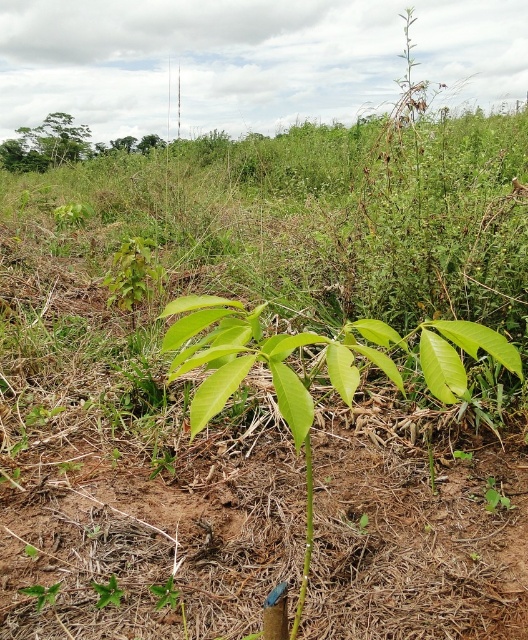
You are a gardener who wants to water the green glossy leaf at center and the green leafy tree at upper left. Which one requires more water based on their sizes?

The green glossy leaf at center is smaller than the green leafy tree at upper left, so the green leafy tree at upper left likely requires more water.

You are a gardener looking at this outdoor scene. You see the green glossy leaf at center and the green leafy tree at upper left. Which of these two objects is positioned more to the east if the image is oriented with north at the top?

The green glossy leaf at center is positioned more to the east than the green leafy tree at upper left since it is to the right of it in the image, and the image is oriented with north at the top.

In the scene shown: You are a photographer trying to capture a closeup of the young plant with broad leaves. You are currently positioned at point (180, 339) and want to move closer to the plant. Is point (61, 122) a better position to get a closer shot of the young plant with broad leaves?

Point (180, 339) is closer to the camera than point (61, 122). Therefore, if you are at point (180, 339) and want to get a closer shot of the young plant with broad leaves, moving to point (61, 122) would actually take you farther away from the plant. You should move in the opposite direction to get closer.